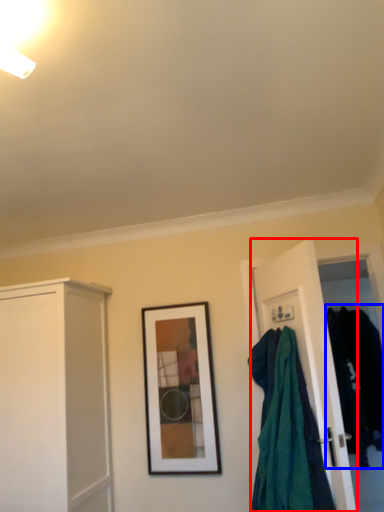
Question: Which of the following is the closest to the observer, door (highlighted by a red box) or clothing (highlighted by a blue box)?

Choices:
 (A) door
 (B) clothing

Answer: (A)